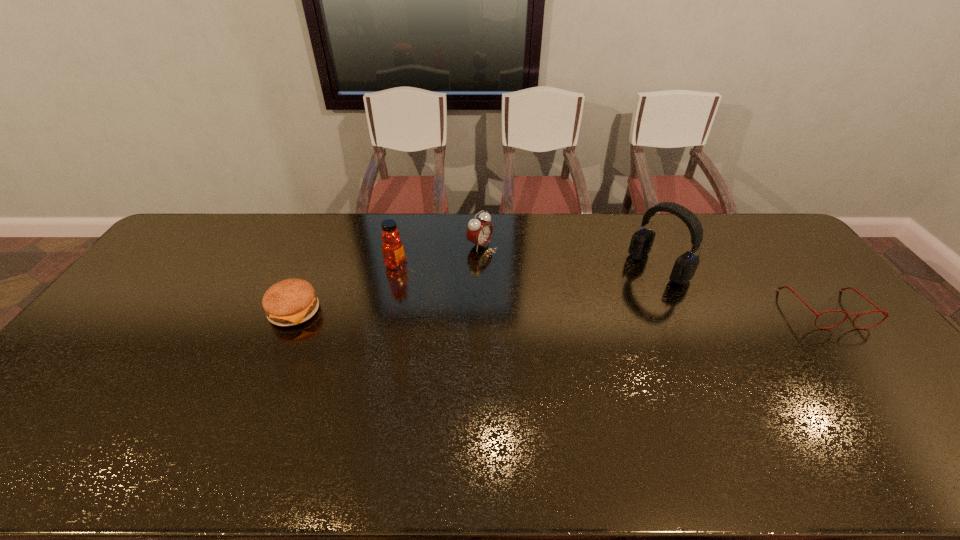
The height and width of the screenshot is (540, 960). In order to click on vacant area that lies between the second tallest object and the shortest object in this screenshot , I will do `click(611, 286)`.

You are a GUI agent. You are given a task and a screenshot of the screen. Output one action in this format:
    pyautogui.click(x=<x>, y=<y>)
    Task: Click on the vacant area between the honey and the third tallest object
    
    Given the screenshot: What is the action you would take?
    pyautogui.click(x=438, y=254)

This screenshot has width=960, height=540. I want to click on vacant region between the leftmost object and the spectacles, so click(560, 309).

Locate an element on the screen. The height and width of the screenshot is (540, 960). unoccupied position between the third object from right to left and the second object from left to right is located at coordinates (438, 254).

This screenshot has width=960, height=540. Identify the location of free space that is in between the tallest object and the third shortest object. (569, 256).

This screenshot has height=540, width=960. Identify the location of empty space between the tallest object and the second tallest object. (527, 265).

Find the location of a particular element. free space between the third object from right to left and the leftmost object is located at coordinates (387, 278).

At what (x,y) coordinates should I click in order to perform the action: click on the second closest object to the leftmost object. Please return your answer as a coordinate pair (x, y). Looking at the image, I should click on (479, 232).

Choose which object is the nearest neighbor to the second tallest object. Please provide its 2D coordinates. Your answer should be formatted as a tuple, i.e. [(x, y)], where the tuple contains the x and y coordinates of a point satisfying the conditions above.

[(290, 302)]

This screenshot has width=960, height=540. Find the location of `free region that satisfies the following two spatial constraints: 1. on the front side of the headset; 2. on the right side of the second tallest object`. free region that satisfies the following two spatial constraints: 1. on the front side of the headset; 2. on the right side of the second tallest object is located at coordinates (395, 267).